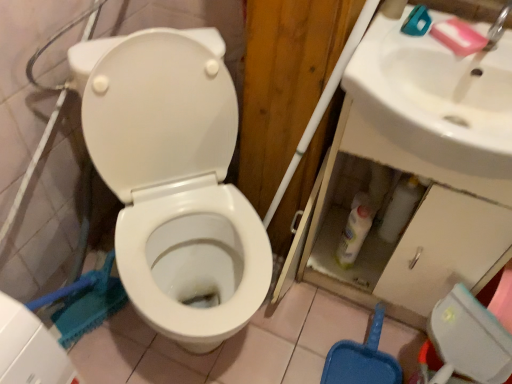
Question: Is white glossy sink at upper right shorter than white glossy bottle at lower center?

Choices:
 (A) no
 (B) yes

Answer: (B)

Question: Considering the relative positions of white glossy sink at upper right and white glossy bottle at lower center in the image provided, is white glossy sink at upper right to the right of white glossy bottle at lower center from the viewer's perspective?

Choices:
 (A) yes
 (B) no

Answer: (A)

Question: Can you confirm if white glossy sink at upper right is wider than white glossy bottle at lower center?

Choices:
 (A) no
 (B) yes

Answer: (B)

Question: Can you confirm if white glossy sink at upper right is taller than white glossy bottle at lower center?

Choices:
 (A) yes
 (B) no

Answer: (B)

Question: From the image's perspective, is white glossy sink at upper right above white glossy bottle at lower center?

Choices:
 (A) yes
 (B) no

Answer: (A)

Question: From a real-world perspective, is white glossy sink at upper right located beneath white glossy bottle at lower center?

Choices:
 (A) no
 (B) yes

Answer: (A)

Question: From a real-world perspective, is white glossy bottle at lower center beneath white glossy toilet at center?

Choices:
 (A) no
 (B) yes

Answer: (B)

Question: Is white glossy bottle at lower center at the left side of white glossy toilet at center?

Choices:
 (A) no
 (B) yes

Answer: (A)

Question: Can you confirm if white glossy bottle at lower center is wider than white glossy toilet at center?

Choices:
 (A) yes
 (B) no

Answer: (B)

Question: Can you confirm if white glossy bottle at lower center is thinner than white glossy toilet at center?

Choices:
 (A) no
 (B) yes

Answer: (B)

Question: Is the depth of white glossy bottle at lower center greater than that of white glossy toilet at center?

Choices:
 (A) yes
 (B) no

Answer: (A)

Question: Would you say white glossy bottle at lower center is outside white glossy toilet at center?

Choices:
 (A) yes
 (B) no

Answer: (A)

Question: Considering the relative positions of white glossy toilet at center and white glossy sink at upper right in the image provided, is white glossy toilet at center to the right of white glossy sink at upper right from the viewer's perspective?

Choices:
 (A) yes
 (B) no

Answer: (B)